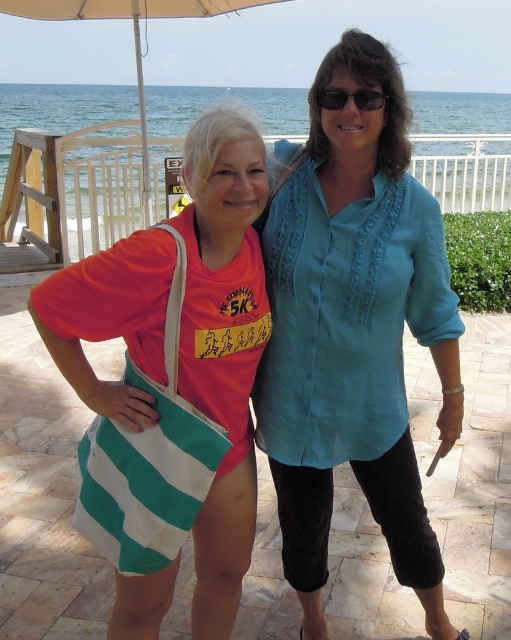
Which is below, teal fabric blouse at center or green striped tote bag at center?

green striped tote bag at center

Can you confirm if teal fabric blouse at center is shorter than green striped tote bag at center?

No.

Where is `teal fabric blouse at center`? This screenshot has width=511, height=640. teal fabric blouse at center is located at coordinates (354, 332).

Is green striped tote bag at center smaller than beige fabric umbrella at upper center?

No, green striped tote bag at center is not smaller than beige fabric umbrella at upper center.

Between point (247, 477) and point (78, 8), which one is positioned in front?

Point (247, 477) is in front.

Locate an element on the screen. Image resolution: width=511 pixels, height=640 pixels. green striped tote bag at center is located at coordinates (225, 184).

Image resolution: width=511 pixels, height=640 pixels. In order to click on green striped tote bag at center in this screenshot , I will do tap(225, 184).

Is teal fabric blouse at center above black plastic sunglasses at upper center?

No.

Between point (405, 225) and point (323, 97), which one is positioned behind?

Positioned behind is point (405, 225).

The height and width of the screenshot is (640, 511). What are the coordinates of `teal fabric blouse at center` in the screenshot? It's located at (354, 332).